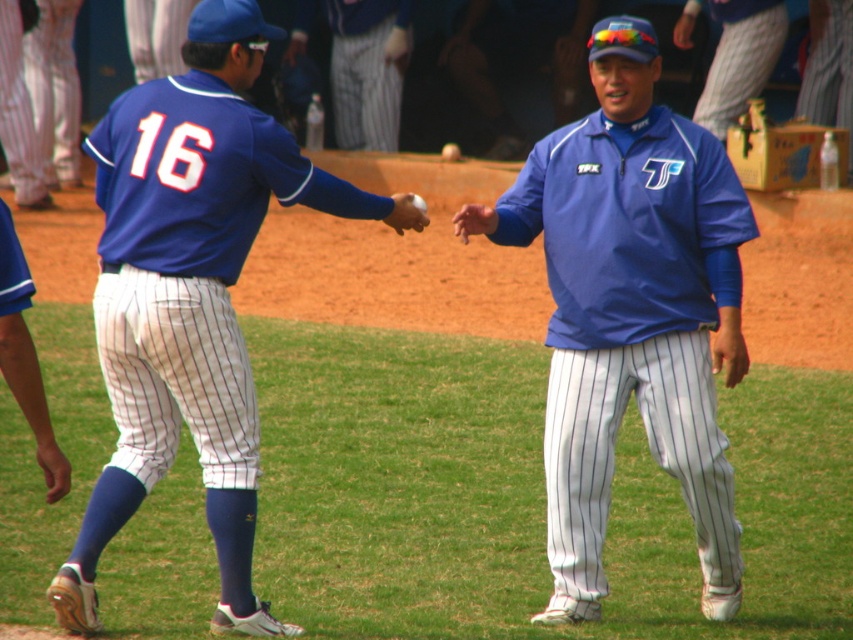
Between matte blue jersey at center and white pinstriped pants at lower left, which one appears on the left side from the viewer's perspective?

From the viewer's perspective, white pinstriped pants at lower left appears more on the left side.

Which of these two, matte blue jersey at center or white pinstriped pants at lower left, stands shorter?

white pinstriped pants at lower left is shorter.

What do you see at coordinates (190, 294) in the screenshot?
I see `matte blue jersey at center` at bounding box center [190, 294].

Identify the location of matte blue jersey at center. (190, 294).

Is point (666, 259) closer to viewer compared to point (138, 112)?

No, it is not.

Can you confirm if blue fabric shirt at center is positioned above matte blue jersey at center?

No.

Is point (699, 323) farther from viewer compared to point (125, 364)?

Yes, point (699, 323) is farther from viewer.

This screenshot has width=853, height=640. Identify the location of blue fabric shirt at center. (631, 310).

Is point (749, 77) behind point (10, 76)?

Yes, point (749, 77) is behind point (10, 76).

Is white pinstriped pants at center in front of white pinstriped pants at lower left?

Yes, white pinstriped pants at center is closer to the viewer.

Which is behind, point (769, 17) or point (24, 195)?

The point (24, 195) is behind.

The height and width of the screenshot is (640, 853). Find the location of `white pinstriped pants at center`. white pinstriped pants at center is located at coordinates (740, 58).